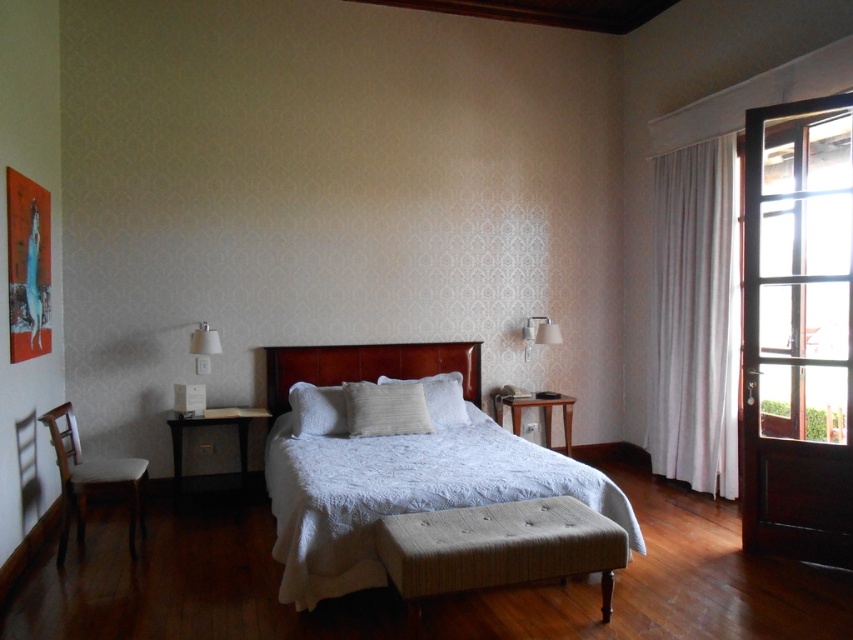
Question: Can you confirm if wooden headboard at center is bigger than light brown wooden chair at lower left?

Choices:
 (A) yes
 (B) no

Answer: (B)

Question: Is transparent glass door at right smaller than wooden headboard at center?

Choices:
 (A) no
 (B) yes

Answer: (A)

Question: Which point is farther from the camera taking this photo?

Choices:
 (A) (202, 417)
 (B) (368, 429)

Answer: (A)

Question: Does transparent glass door at right have a larger size compared to white sheer curtain at right?

Choices:
 (A) yes
 (B) no

Answer: (A)

Question: Among these objects, which one is farthest from the camera?

Choices:
 (A) white textured bed at center
 (B) transparent glass door at right
 (C) light brown wooden chair at lower left

Answer: (C)

Question: Which object appears closest to the camera in this image?

Choices:
 (A) light beige textured pillow at center
 (B) white soft pillow at center

Answer: (A)